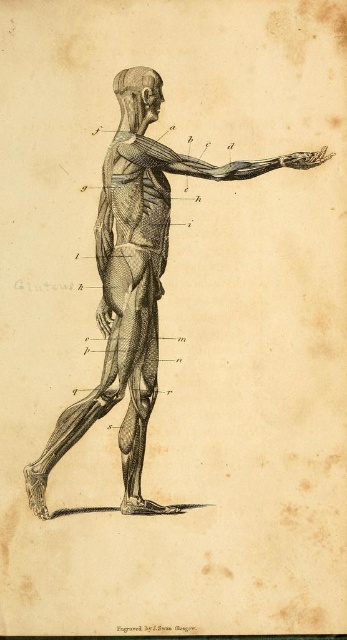
Can you confirm if matte black arm at upper center is positioned to the left of smooth gray skull at upper center?

Incorrect, matte black arm at upper center is not on the left side of smooth gray skull at upper center.

Who is positioned more to the left, matte black arm at upper center or smooth gray skull at upper center?

smooth gray skull at upper center is more to the left.

Between point (308, 154) and point (155, 115), which one is positioned behind?

The point (155, 115) is more distant.

Where is `matte black arm at upper center`? matte black arm at upper center is located at coordinates (206, 161).

Can you confirm if black ink human figure at center is positioned to the left of matte black arm at upper center?

Indeed, black ink human figure at center is positioned on the left side of matte black arm at upper center.

Is point (155, 275) positioned behind point (286, 164)?

No, it is not.

Where is `black ink human figure at center`? black ink human figure at center is located at coordinates click(133, 301).

Is black ink human figure at center positioned at the back of smooth gray skull at upper center?

No, it is not.

Does black ink human figure at center appear over smooth gray skull at upper center?

Incorrect, black ink human figure at center is not positioned above smooth gray skull at upper center.

Is point (148, 252) more distant than point (139, 132)?

No, it is in front of (139, 132).

Where is `black ink human figure at center`? black ink human figure at center is located at coordinates (133, 301).